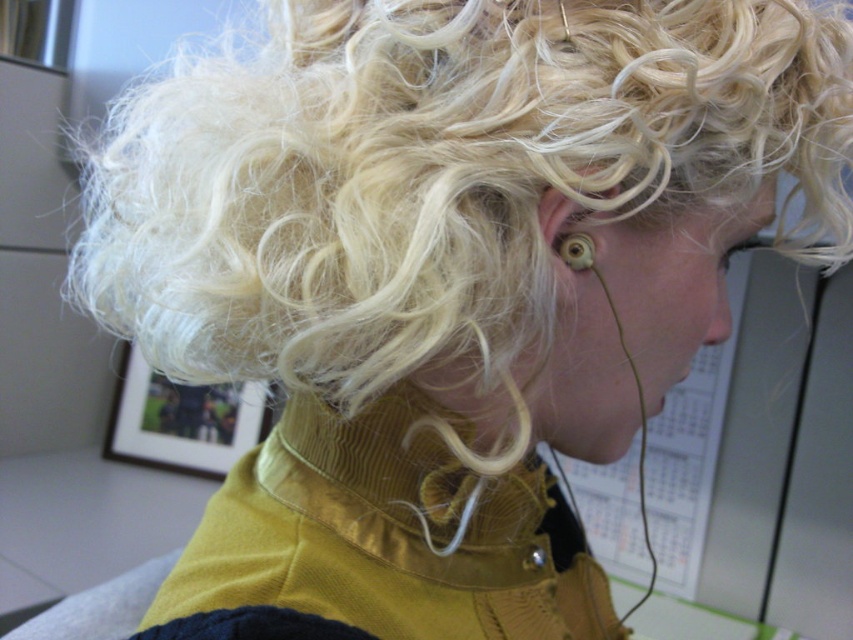
Question: Which point is farther to the camera?

Choices:
 (A) (515, 476)
 (B) (587, 240)

Answer: (A)

Question: Is the position of yellow cord at center less distant than that of gold metallic earring at ear?

Choices:
 (A) yes
 (B) no

Answer: (A)

Question: Which point appears farthest from the camera in this image?

Choices:
 (A) (500, 500)
 (B) (563, 244)

Answer: (A)

Question: Is yellow cord at center behind gold metallic earring at ear?

Choices:
 (A) no
 (B) yes

Answer: (A)

Question: Among these points, which one is farthest from the camera?

Choices:
 (A) (318, 468)
 (B) (589, 266)

Answer: (A)

Question: Can you confirm if yellow cord at center is wider than gold metallic earring at ear?

Choices:
 (A) no
 (B) yes

Answer: (B)